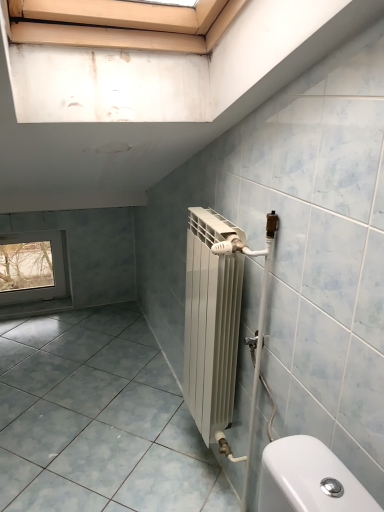
Question: Is transparent glass window at lower left taller or shorter than matte gray tile at lower left?

Choices:
 (A) short
 (B) tall

Answer: (B)

Question: Relative to matte gray tile at lower left, is transparent glass window at lower left in front or behind?

Choices:
 (A) front
 (B) behind

Answer: (B)

Question: Considering the positions of transparent glass window at lower left and matte gray tile at lower left in the image, is transparent glass window at lower left wider or thinner than matte gray tile at lower left?

Choices:
 (A) wide
 (B) thin

Answer: (B)

Question: Considering the positions of matte gray tile at lower left and transparent glass window at lower left in the image, is matte gray tile at lower left wider or thinner than transparent glass window at lower left?

Choices:
 (A) thin
 (B) wide

Answer: (B)

Question: Is matte gray tile at lower left to the left or to the right of transparent glass window at lower left in the image?

Choices:
 (A) right
 (B) left

Answer: (A)

Question: From a real-world perspective, relative to transparent glass window at lower left, is matte gray tile at lower left vertically above or below?

Choices:
 (A) below
 (B) above

Answer: (A)

Question: Is matte gray tile at lower left bigger or smaller than transparent glass window at lower left?

Choices:
 (A) small
 (B) big

Answer: (B)